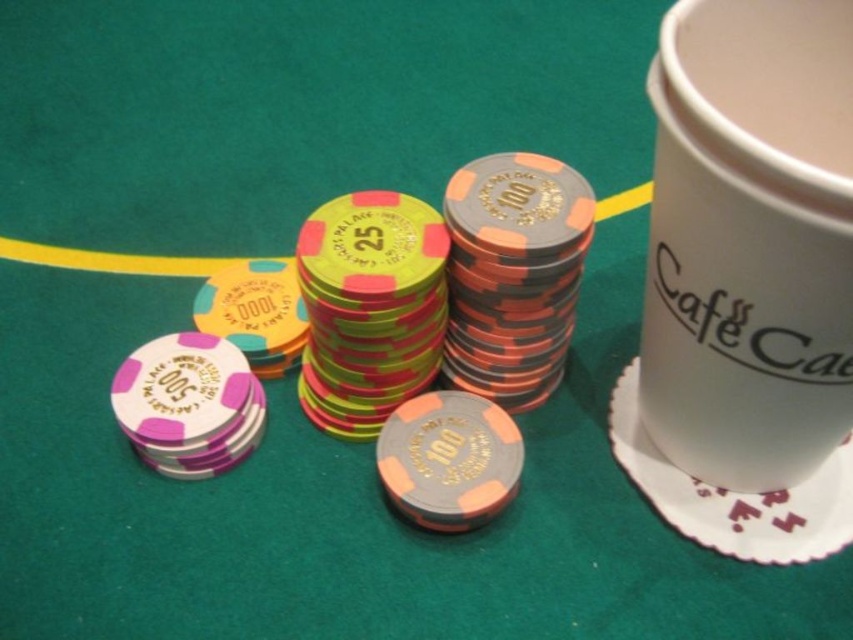
Does point (784, 467) come farther from viewer compared to point (807, 508)?

No, (784, 467) is closer to viewer.

Does white paper cup at right have a lesser width compared to white paper saucer at upper right?

Yes, white paper cup at right is thinner than white paper saucer at upper right.

Where is `white paper cup at right`? This screenshot has height=640, width=853. white paper cup at right is located at coordinates (750, 241).

Locate an element on the screen. This screenshot has width=853, height=640. white paper cup at right is located at coordinates (750, 241).